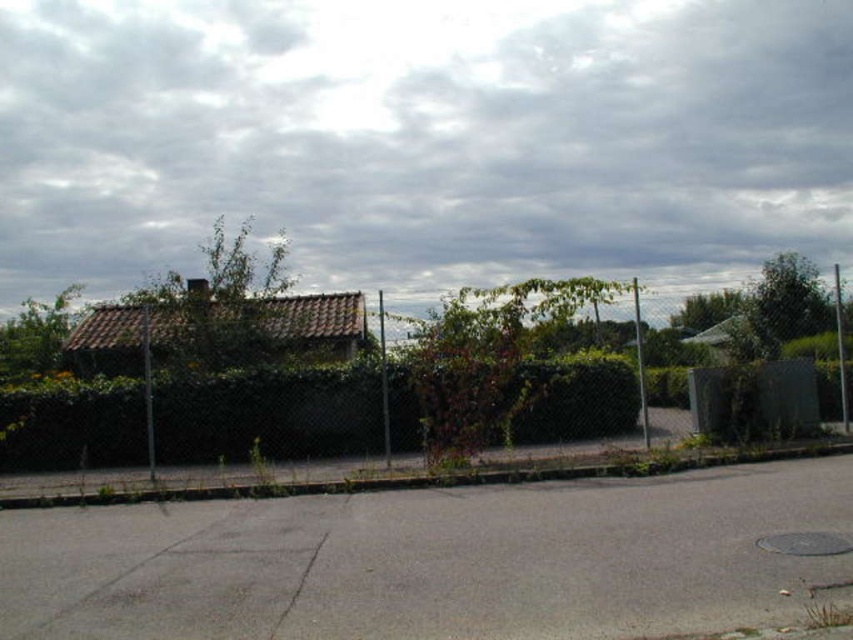
Question: Can you confirm if cloudy sky at upper center is positioned to the right of green leafy hedge at center?

Choices:
 (A) yes
 (B) no

Answer: (A)

Question: Which object appears closest to the camera in this image?

Choices:
 (A) green leafy hedge at center
 (B) metallic chain-link fence at center
 (C) cloudy sky at upper center

Answer: (B)

Question: Estimate the real-world distances between objects in this image. Which object is closer to the cloudy sky at upper center?

Choices:
 (A) metallic chain-link fence at center
 (B) green leafy hedge at center

Answer: (A)

Question: Based on their relative distances, which object is nearer to the cloudy sky at upper center?

Choices:
 (A) metallic chain-link fence at center
 (B) green leafy hedge at center

Answer: (A)

Question: Considering the relative positions of metallic chain-link fence at center and green leafy hedge at center in the image provided, where is metallic chain-link fence at center located with respect to green leafy hedge at center?

Choices:
 (A) right
 (B) left

Answer: (A)

Question: Is the position of metallic chain-link fence at center more distant than that of green leafy hedge at center?

Choices:
 (A) yes
 (B) no

Answer: (B)